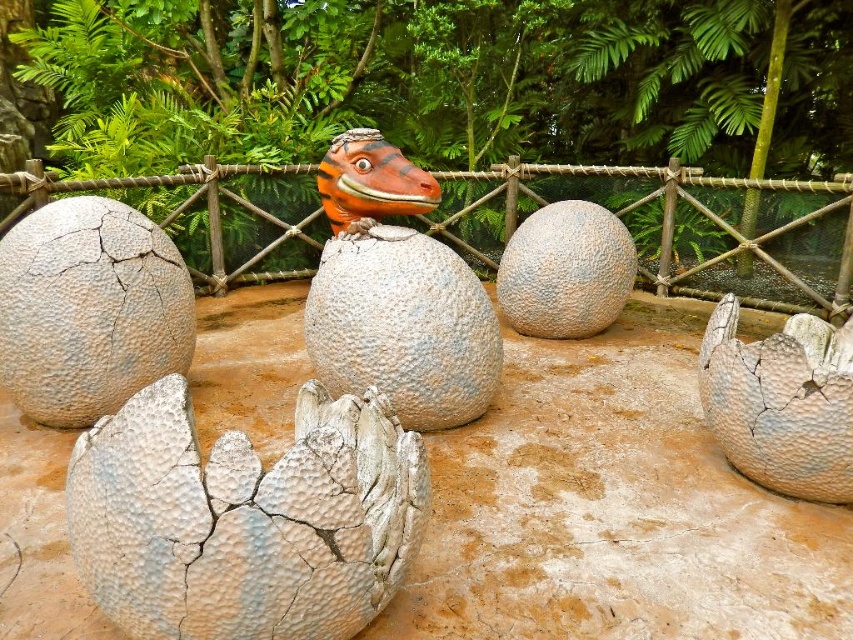
You are a visitor at the exhibit and want to take a photo of the shiny orange dinosaur head at center without the gray cracked egg at center blocking the view. Is this possible?

The gray cracked egg at center is closer to the viewer than the shiny orange dinosaur head at center, so the egg will block the view of the dinosaur head. You cannot take a photo without the egg blocking it.

You are a tour guide leading a group of children through the exhibit. You want to point out the speckled stone egg at center to them. Where exactly should you direct their attention?

The speckled stone egg at center is located at the coordinates point (403, 326).

You are a tour guide leading a group of children through the exhibit. You want to point out the exact location of the white cracked egg at center to them. What coordinates should you mention?

The white cracked egg at center is located at coordinates point (245, 518).